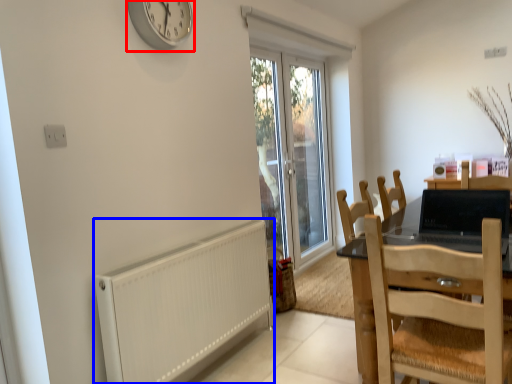
Question: Which object is further to the camera taking this photo, clock (highlighted by a red box) or radiator (highlighted by a blue box)?

Choices:
 (A) clock
 (B) radiator

Answer: (A)